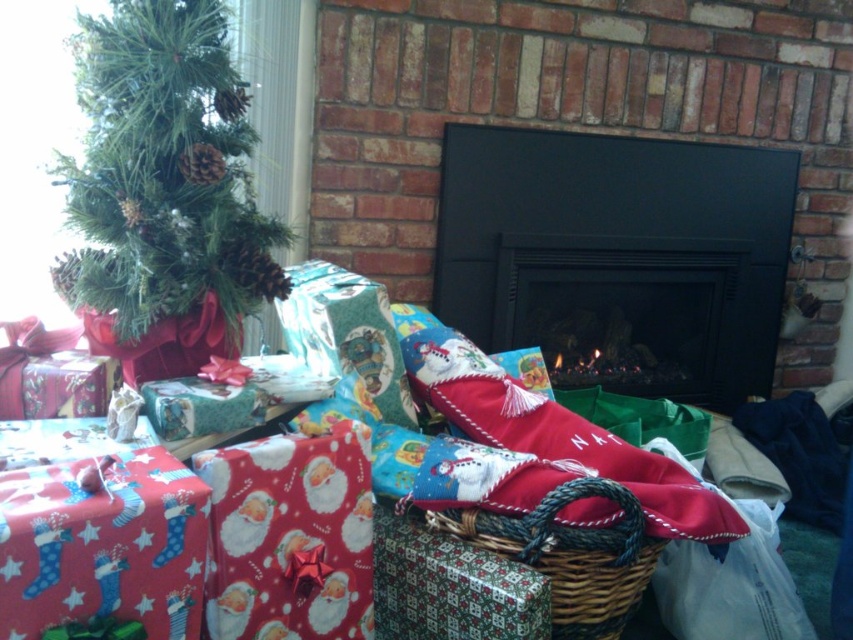
Question: Which point is farther to the camera?

Choices:
 (A) (558, 332)
 (B) (373, 529)

Answer: (A)

Question: Which object is positioned closest to the santa-themed fabric stocking at center?

Choices:
 (A) red matte wrapping paper at lower left
 (B) woven brown basket at center
 (C) green matte christmas tree at upper left

Answer: (B)

Question: Which point is closer to the camera taking this photo?

Choices:
 (A) (374, 561)
 (B) (541, 433)
 (C) (119, 83)

Answer: (C)

Question: Does santa-themed fabric stocking at center appear over patterned paper gift at center?

Choices:
 (A) no
 (B) yes

Answer: (B)

Question: Is the position of red matte wrapping paper at lower left less distant than that of santa-themed fabric stocking at center?

Choices:
 (A) no
 (B) yes

Answer: (B)

Question: Considering the relative positions of santa-themed fabric stocking at center and woven brown basket at center in the image provided, where is santa-themed fabric stocking at center located with respect to woven brown basket at center?

Choices:
 (A) above
 (B) below

Answer: (A)